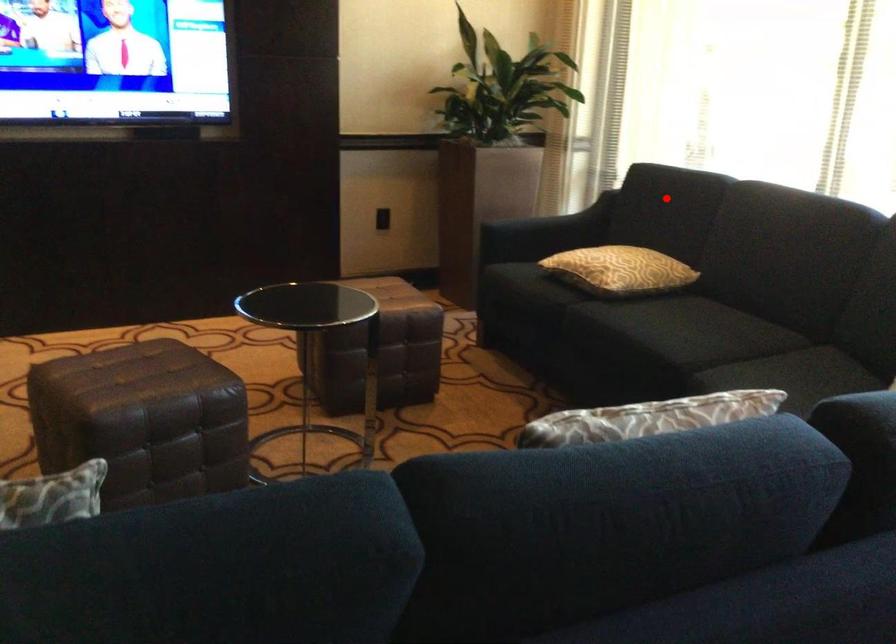
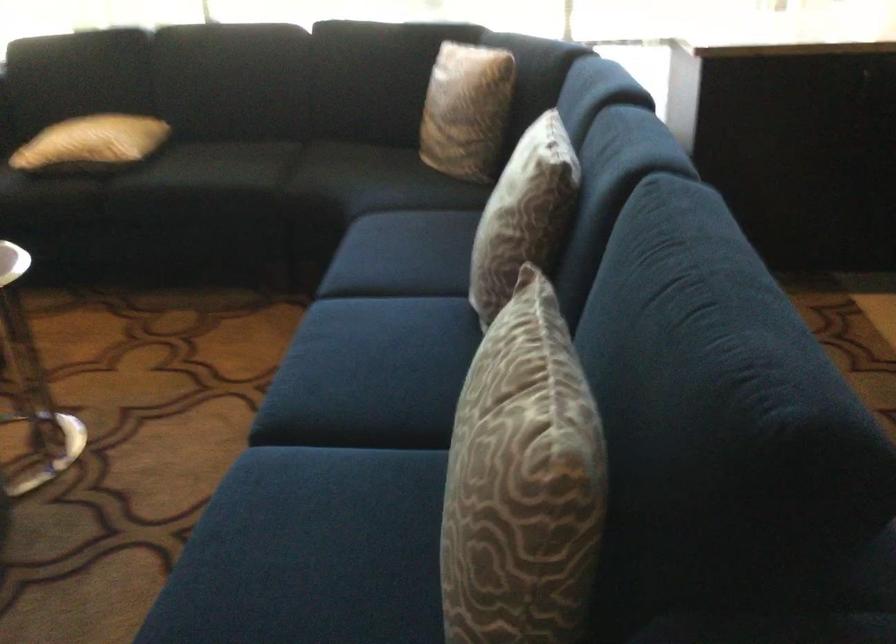
Find the pixel in the second image that matches the highlighted location in the first image.

(82, 64)